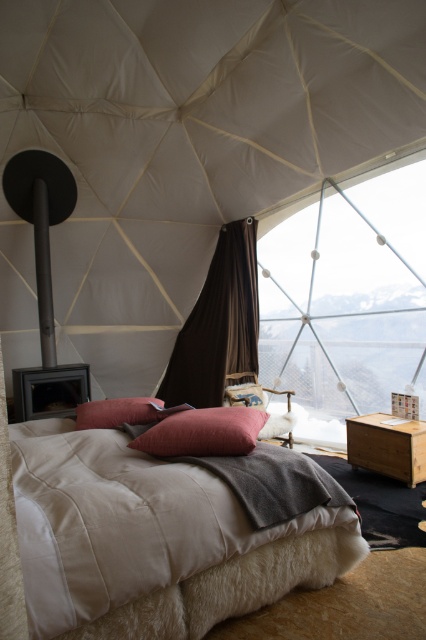
You are setting up a luxury glamping site and need to arrange the beige cotton bed at center and the pink velvet pillow at center. According to the image, which object is closer to the entrance of the tent?

The beige cotton bed at center is closer to the entrance of the tent because it is positioned in front of the pink velvet pillow at center, indicating it is nearer to the viewer who would typically enter from the entrance facing the interior.

You are standing inside the geodesic dome tent and want to place a small lamp between the two points labeled point (141, 227) and point (397, 477). Which point is closer to you so you can place the lamp there first?

Point (141, 227) is closer to you than point (397, 477), so you should place the lamp near point (141, 227) first.